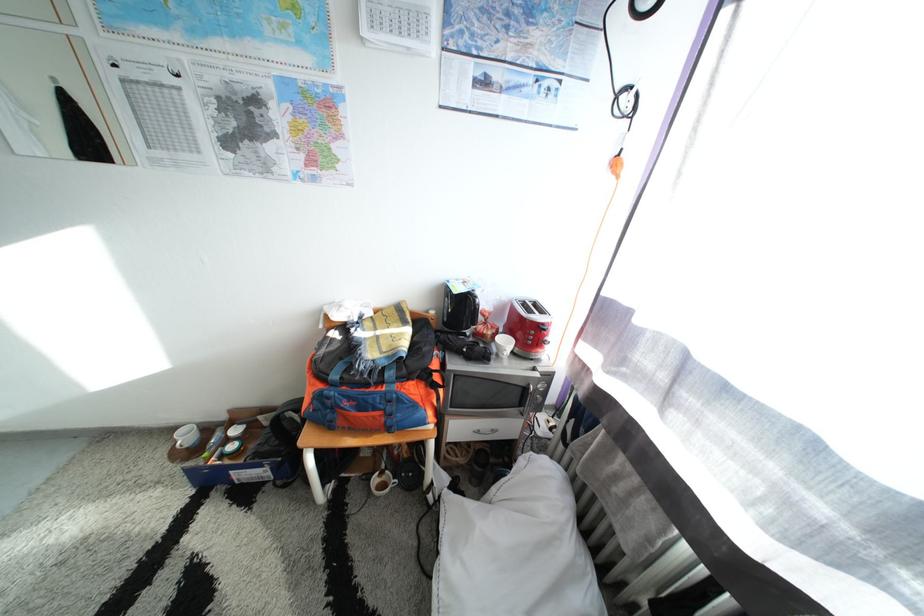
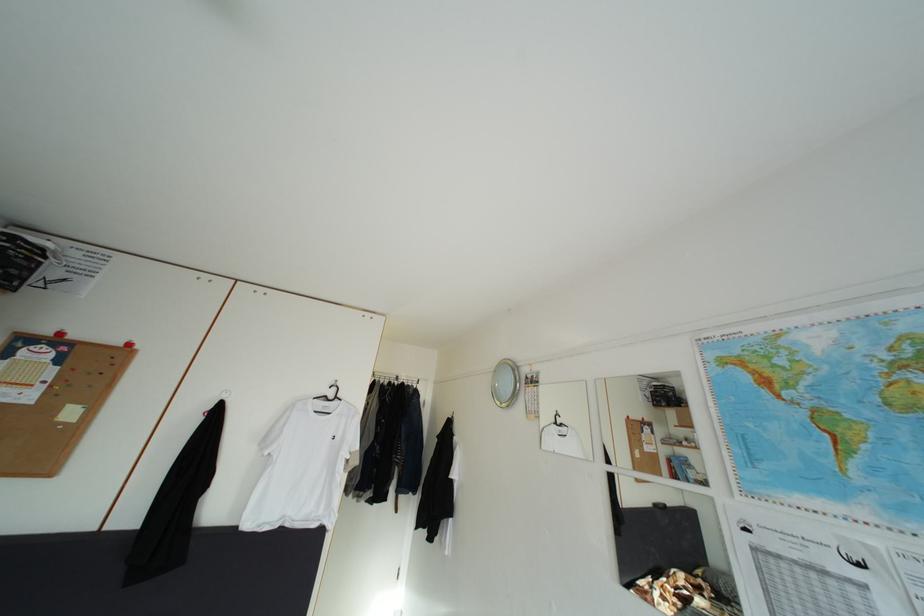
First-person continuous shooting, in which direction is the camera rotating?

The camera rotated toward left-up.